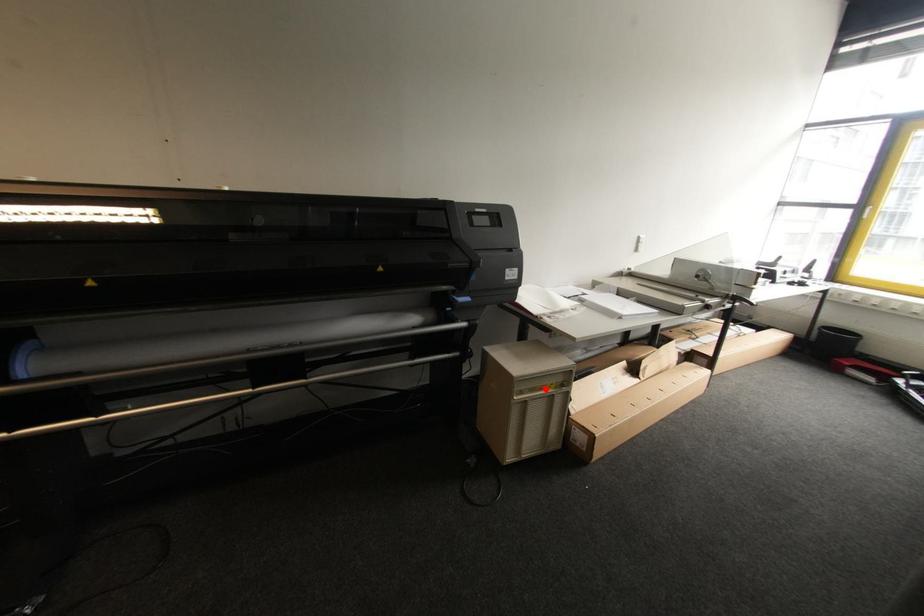
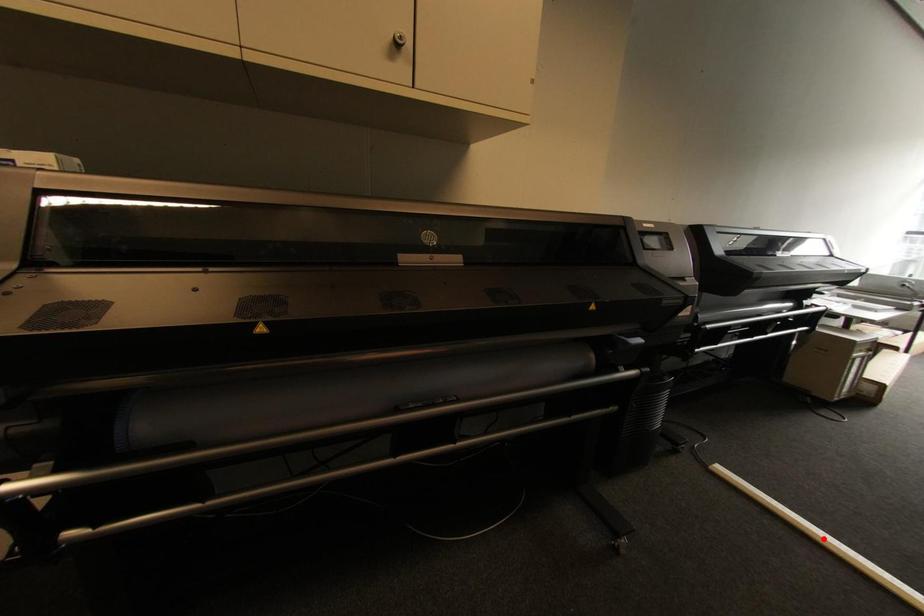
I am providing you with two images of the same scene from different viewpoints. A red point is marked on the first image and another point is marked on the second image. Are the points marked in image1 and image2 representing the same 3D position?

No